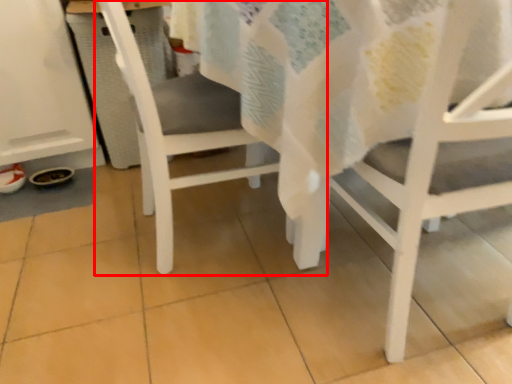
Question: In this image, where is chair (annotated by the red box) located relative to chair?

Choices:
 (A) left
 (B) right

Answer: (A)